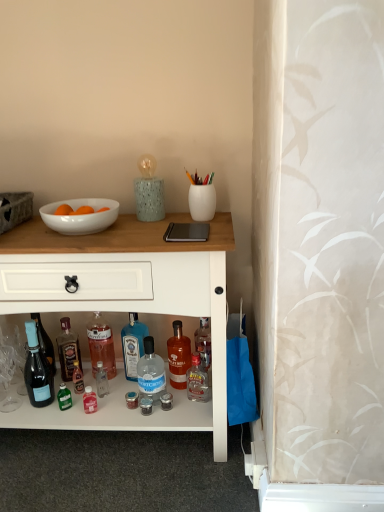
Question: Does point (92, 335) appear closer or farther from the camera than point (132, 329)?

Choices:
 (A) farther
 (B) closer

Answer: (A)

Question: Would you say clear glass bottle at center, which is the fourth bottle from right to left, is to the left or to the right of blue glass bottle at center, which is counted as the 3th bottle, starting from the left, in the picture?

Choices:
 (A) right
 (B) left

Answer: (B)

Question: Which object is positioned farthest from the blue glass bottle at center, which is counted as the 3th bottle, starting from the left?

Choices:
 (A) clear glass bottle at center, which is the fourth bottle from right to left
 (B) shiny dark brown bottle at lower left, positioned as the 1th bottle in left-to-right order
 (C) white glossy cabinet at center
 (D) translucent amber glass bottle at center, which is the first bottle in right-to-left order
 (E) clear glass bottle at center, placed as the 4th bottle when sorted from left to right

Answer: (C)

Question: Estimate the real-world distances between objects in this image. Which object is farther from the clear glass bottle at center, which is counted as the 2th bottle, starting from the right?

Choices:
 (A) clear glass bottle at center, which ranks as the 2th bottle in left-to-right order
 (B) white glossy cabinet at center
 (C) shiny dark brown bottle at lower left, the fifth bottle from the right
 (D) matte black champagne bottle at lower left
 (E) white glossy bowl at upper left

Answer: (E)